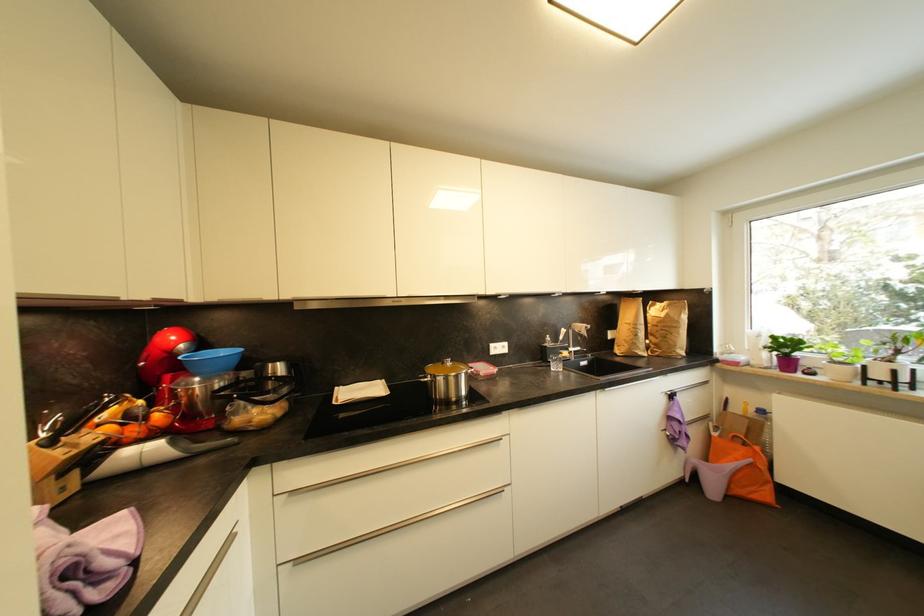
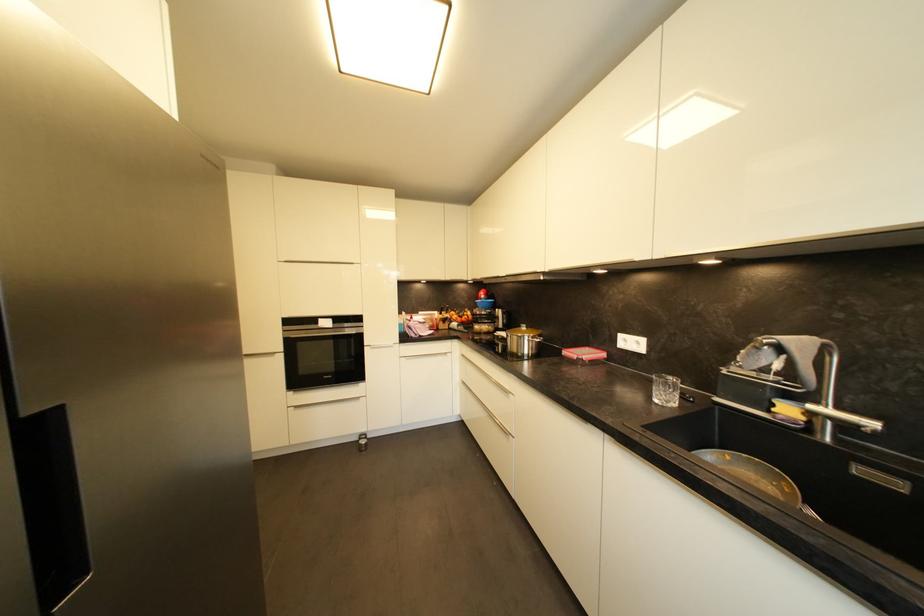
Locate, in the second image, the point that corresponds to [478,363] in the first image.

(602, 350)